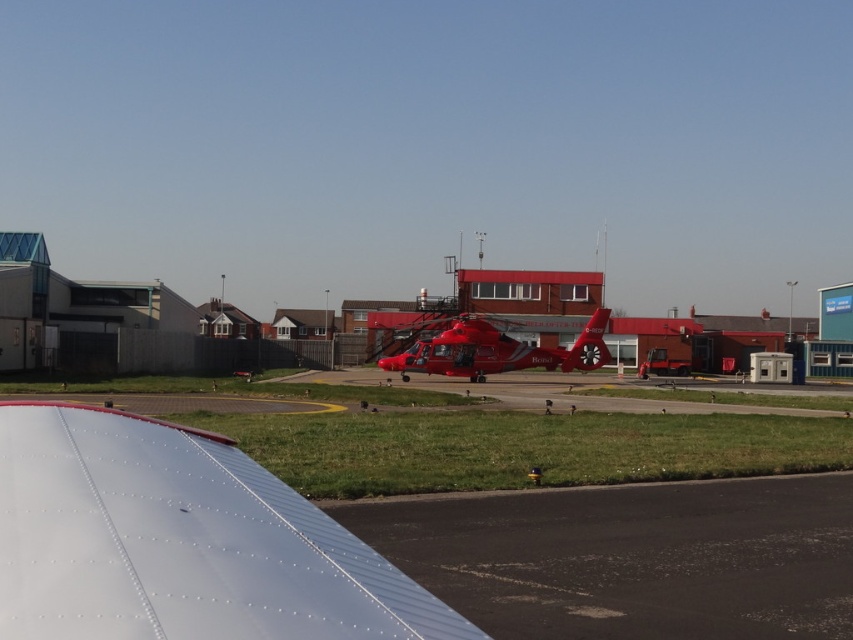
You are a pilot preparing to land a small plane at the heliport. You notice the white metallic wing at lower left in the image. Based on its position, where should you aim your landing path to avoid it?

You should aim your landing path away from the white metallic wing at lower left, which is located at the lower left corner of the image, to ensure a safe landing.

You are a pilot preparing to land a small plane on the black asphalt runway at lower center. The metallic red helicopter at center is parked nearby. Based on the scene, will the helicopter obstruct your view of the runway during landing?

The black asphalt runway at lower center has a lesser height compared to the metallic red helicopter at center. Since the runway is lower, the helicopter might block your view of the runway during landing, so you should adjust your approach to ensure visibility.